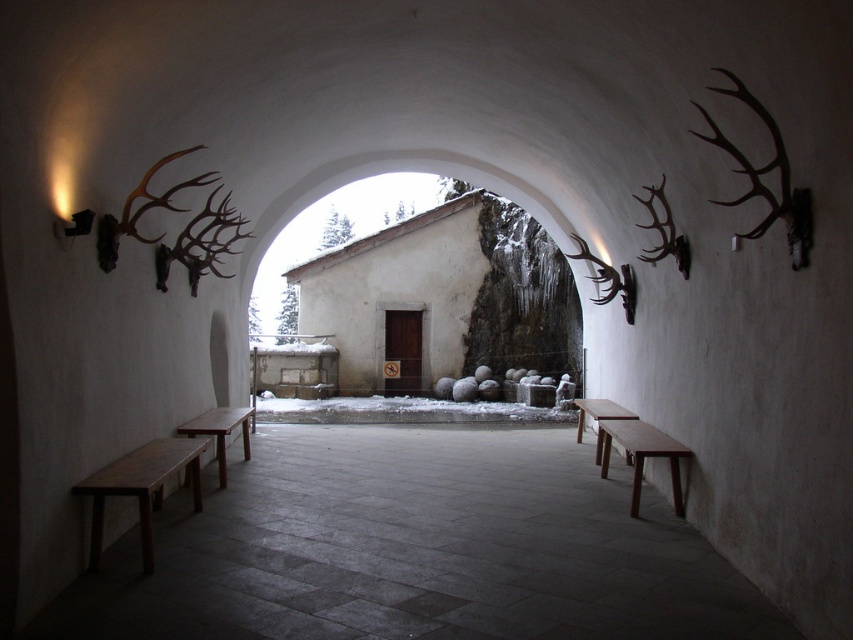
Question: Does wooden bench at left appear over smooth wooden bench at lower right?

Choices:
 (A) yes
 (B) no

Answer: (A)

Question: Which is nearer to the wooden bench at left?

Choices:
 (A) smooth wooden bench at lower right
 (B) wooden bench at center
 (C) smooth wooden bench at center

Answer: (C)

Question: Considering the relative positions of smooth wooden bench at center and smooth wooden bench at lower right in the image provided, where is smooth wooden bench at center located with respect to smooth wooden bench at lower right?

Choices:
 (A) left
 (B) right

Answer: (A)

Question: Which object is positioned farthest from the smooth wooden bench at lower right?

Choices:
 (A) smooth wooden bench at center
 (B) wooden bench at left
 (C) wooden bench at center
 (D) brown wooden bench at center

Answer: (C)

Question: Does smooth wooden bench at lower right appear under wooden bench at center?

Choices:
 (A) no
 (B) yes

Answer: (B)

Question: Estimate the real-world distances between objects in this image. Which object is closer to the smooth wooden bench at center?

Choices:
 (A) smooth wooden bench at lower right
 (B) brown wooden bench at center
 (C) wooden bench at center
 (D) wooden bench at left

Answer: (D)